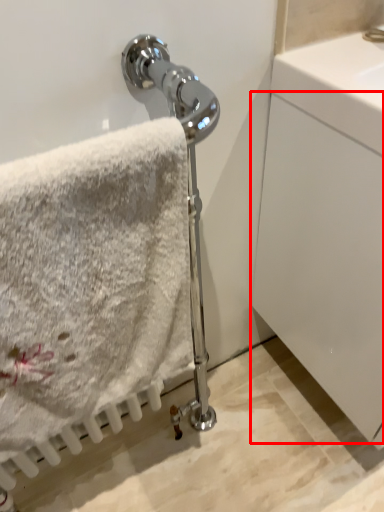
Question: From the image's perspective, what is the correct spatial positioning of glass door (annotated by the red box) in reference to towel?

Choices:
 (A) below
 (B) above

Answer: (B)